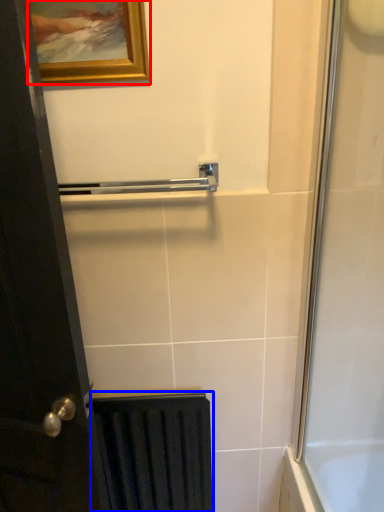
Question: Among these objects, which one is farthest to the camera, picture frame (highlighted by a red box) or radiator (highlighted by a blue box)?

Choices:
 (A) picture frame
 (B) radiator

Answer: (B)